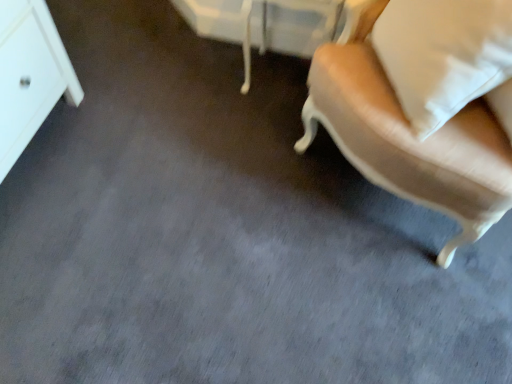
Question: Is white soft pillow at upper right taller than beige fabric chair at right?

Choices:
 (A) no
 (B) yes

Answer: (A)

Question: Does white soft pillow at upper right appear on the right side of beige fabric chair at right?

Choices:
 (A) yes
 (B) no

Answer: (A)

Question: From a real-world perspective, is white soft pillow at upper right under beige fabric chair at right?

Choices:
 (A) yes
 (B) no

Answer: (B)

Question: Is white soft pillow at upper right closer to camera compared to beige fabric chair at right?

Choices:
 (A) yes
 (B) no

Answer: (B)

Question: Is white soft pillow at upper right thinner than beige fabric chair at right?

Choices:
 (A) yes
 (B) no

Answer: (A)

Question: Is white soft pillow at upper right smaller than beige fabric chair at right?

Choices:
 (A) yes
 (B) no

Answer: (A)

Question: Is the depth of white soft pillow at upper right greater than that of white glossy vanity at upper center?

Choices:
 (A) no
 (B) yes

Answer: (A)

Question: From the image's perspective, is white soft pillow at upper right above white glossy vanity at upper center?

Choices:
 (A) no
 (B) yes

Answer: (A)

Question: Can you confirm if white soft pillow at upper right is wider than white glossy vanity at upper center?

Choices:
 (A) no
 (B) yes

Answer: (B)

Question: Is white soft pillow at upper right surrounding white glossy vanity at upper center?

Choices:
 (A) no
 (B) yes

Answer: (A)

Question: Considering the relative sizes of white soft pillow at upper right and white glossy vanity at upper center in the image provided, is white soft pillow at upper right thinner than white glossy vanity at upper center?

Choices:
 (A) yes
 (B) no

Answer: (B)

Question: Is white soft pillow at upper right turned away from white glossy vanity at upper center?

Choices:
 (A) no
 (B) yes

Answer: (A)

Question: Considering the relative positions of beige fabric chair at right and white soft pillow at upper right in the image provided, is beige fabric chair at right to the right of white soft pillow at upper right from the viewer's perspective?

Choices:
 (A) no
 (B) yes

Answer: (A)